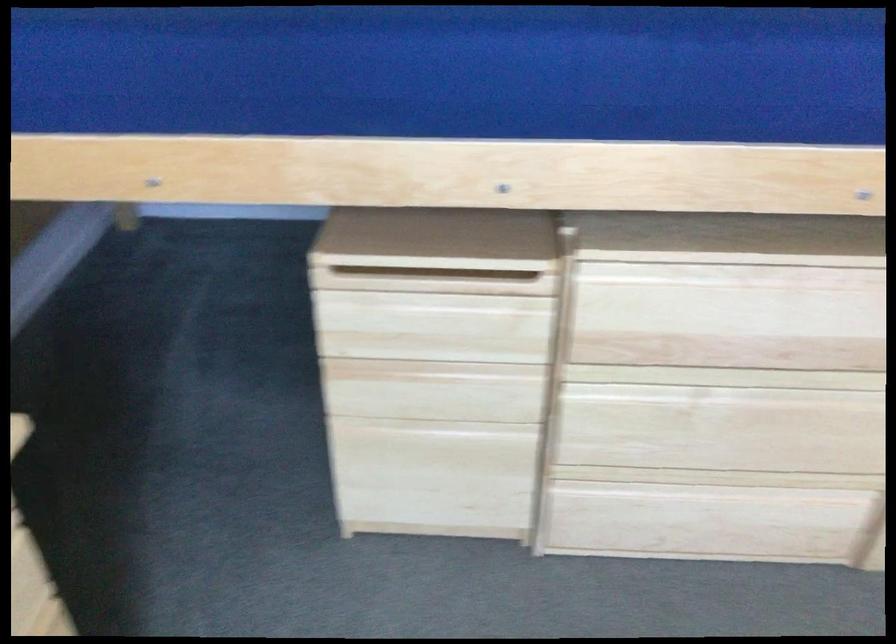
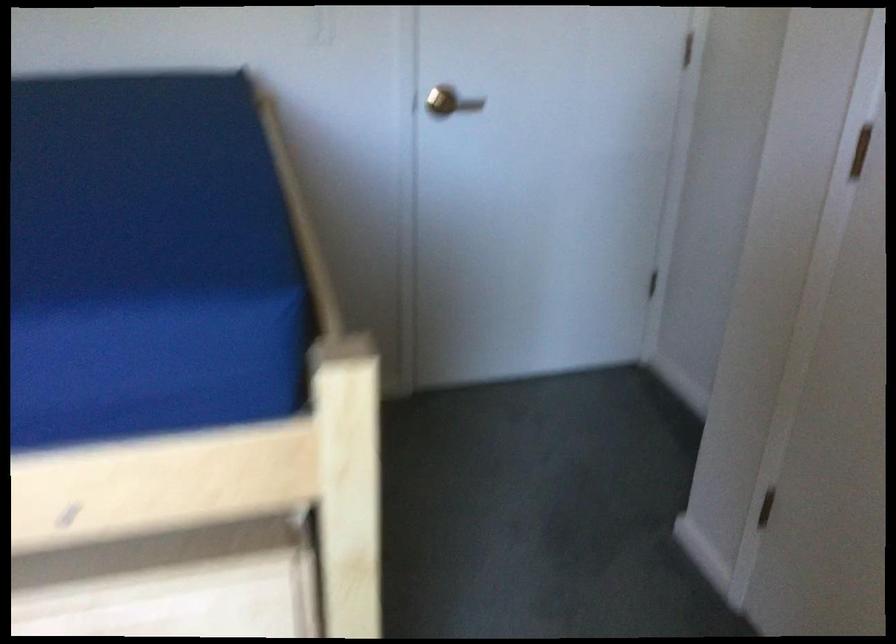
Question: In a continuous first-person perspective shot, in which direction is the camera moving?

Choices:
 (A) Left
 (B) Right
 (C) Forward
 (D) Backward

Answer: (B)